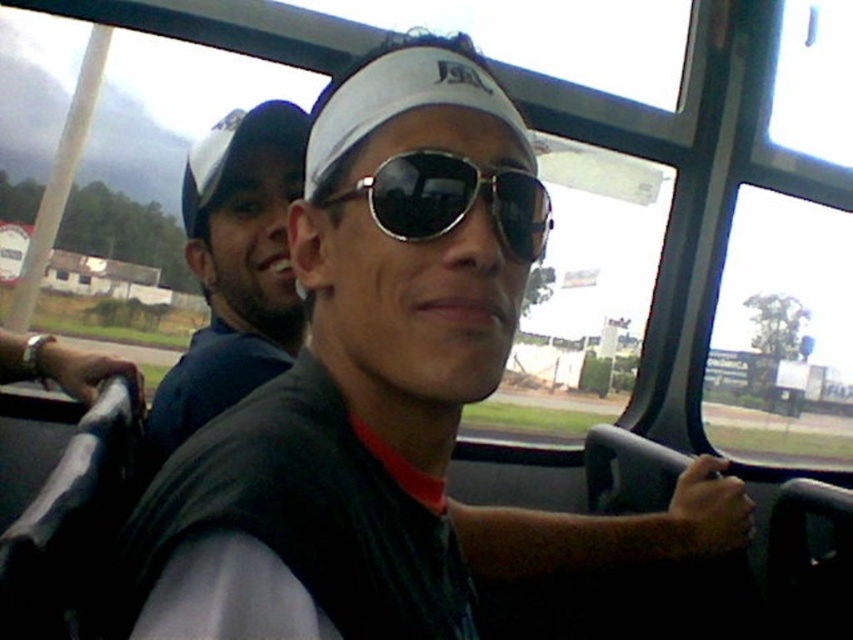
You are a passenger on a bus and want to know the spatial relationship between the blue fabric cap at upper left and the sunglasses at center. Which one is located to the left of the other?

The blue fabric cap at upper left is positioned on the left side of sunglasses at center.

You are inside a vehicle and looking at two points marked on the window. The first point is at coordinates point (x=280, y=346) and the second is at point (x=412, y=205). Which point is closer to you?

The point at coordinates point (x=280, y=346) is closer to you because it is further to the viewer than point (x=412, y=205).